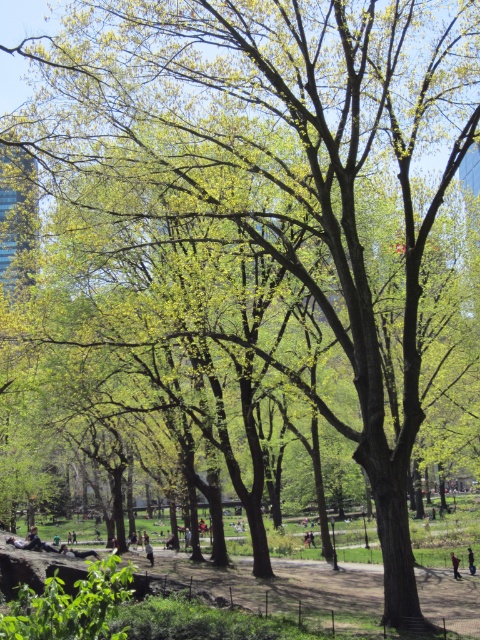
Is green leafy trees at center closer to the viewer compared to dark brown leather jacket at lower right?

Yes, green leafy trees at center is closer to the viewer.

Does point (118, 621) come farther from viewer compared to point (456, 566)?

No, (118, 621) is in front of (456, 566).

At what (x,y) coordinates should I click in order to perform the action: click on green leafy trees at center. Please return your answer as a coordinate pair (x, y). The height and width of the screenshot is (640, 480). Looking at the image, I should click on (302, 595).

Does dark brown leather jacket at lower right have a lesser height compared to light brown wooden bench at center?

Yes, dark brown leather jacket at lower right is shorter than light brown wooden bench at center.

Between dark brown leather jacket at lower right and light brown wooden bench at center, which one has less height?

dark brown leather jacket at lower right is shorter.

What are the coordinates of `dark brown leather jacket at lower right` in the screenshot? It's located at (455, 564).

Does green leafy trees at center have a larger size compared to light brown wooden bench at center?

Indeed, green leafy trees at center has a larger size compared to light brown wooden bench at center.

Identify the location of green leafy trees at center. (302, 595).

Where is `green leafy trees at center`? The height and width of the screenshot is (640, 480). green leafy trees at center is located at coordinates [302, 595].